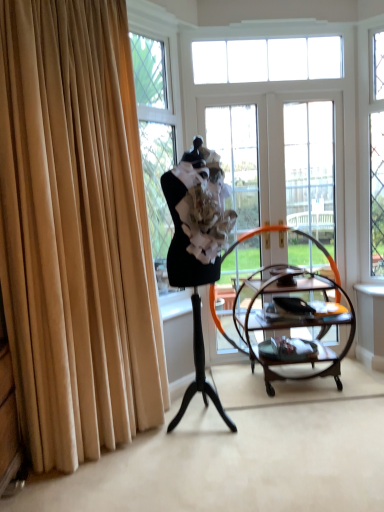
Question: Does clear glass window at upper center appear on the right side of clear glass door at center, arranged as the first glass door when viewed from the right?

Choices:
 (A) yes
 (B) no

Answer: (B)

Question: From a real-world perspective, does clear glass window at upper center sit lower than clear glass door at center, the second glass door from the left?

Choices:
 (A) no
 (B) yes

Answer: (A)

Question: Is clear glass window at upper center completely or partially outside of clear glass door at center, the second glass door from the left?

Choices:
 (A) no
 (B) yes

Answer: (B)

Question: Are clear glass window at upper center and clear glass door at center, the second glass door from the left, making contact?

Choices:
 (A) no
 (B) yes

Answer: (A)

Question: From the image's perspective, is clear glass window at upper center above clear glass door at center, the second glass door from the left?

Choices:
 (A) yes
 (B) no

Answer: (A)

Question: Is clear glass window at upper center to the left of clear glass door at center, the second glass door from the left, from the viewer's perspective?

Choices:
 (A) yes
 (B) no

Answer: (A)

Question: Is mahogany wood serving cart at center located within clear glass door at center, acting as the 1th glass door starting from the left?

Choices:
 (A) no
 (B) yes

Answer: (A)

Question: Is clear glass door at center, which is the second glass door from right to left, bigger than mahogany wood serving cart at center?

Choices:
 (A) yes
 (B) no

Answer: (B)

Question: From the image's perspective, is clear glass door at center, acting as the 1th glass door starting from the left, located above mahogany wood serving cart at center?

Choices:
 (A) yes
 (B) no

Answer: (A)

Question: Is clear glass door at center, acting as the 1th glass door starting from the left, not inside mahogany wood serving cart at center?

Choices:
 (A) no
 (B) yes

Answer: (B)

Question: Could you tell me if clear glass door at center, which is the second glass door from right to left, is turned towards mahogany wood serving cart at center?

Choices:
 (A) no
 (B) yes

Answer: (B)

Question: From a real-world perspective, does clear glass door at center, which is the second glass door from right to left, stand above mahogany wood serving cart at center?

Choices:
 (A) no
 (B) yes

Answer: (B)

Question: Considering the relative sizes of black matte mannequin at center and clear glass window at upper center in the image provided, is black matte mannequin at center wider than clear glass window at upper center?

Choices:
 (A) yes
 (B) no

Answer: (A)